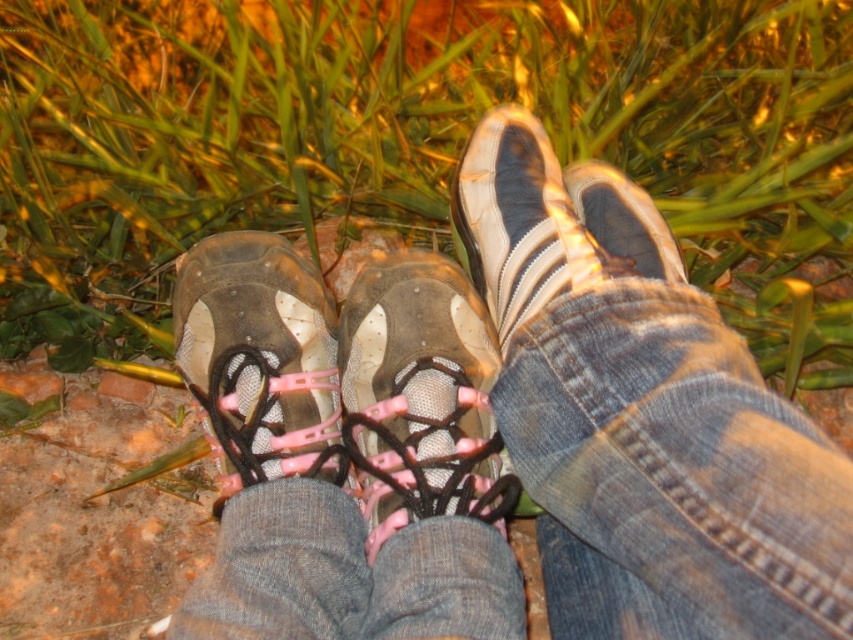
Measure the distance between green grass at center and camera.

The distance of green grass at center from camera is 34.11 inches.

Is point (303, 36) farther from camera compared to point (392, 429)?

Yes, point (303, 36) is behind point (392, 429).

The width and height of the screenshot is (853, 640). What do you see at coordinates (415, 141) in the screenshot?
I see `green grass at center` at bounding box center [415, 141].

The height and width of the screenshot is (640, 853). I want to click on green grass at center, so click(x=415, y=141).

Does point (374, 147) lie in front of point (763, 481)?

No, (374, 147) is further to viewer.

Does green grass at center lie behind pink mesh sneakers at center?

Yes, it is.

Identify the location of green grass at center. (415, 141).

Find the location of a particular element. The width and height of the screenshot is (853, 640). green grass at center is located at coordinates (415, 141).

Who is higher up, pink mesh sneakers at center or matte rubber shoe at center?

matte rubber shoe at center is higher up.

Based on the photo, is pink mesh sneakers at center taller than matte rubber shoe at center?

Correct, pink mesh sneakers at center is much taller as matte rubber shoe at center.

Who is more forward, [741,595] or [196,264]?

Positioned in front is point [741,595].

This screenshot has width=853, height=640. What are the coordinates of `pink mesh sneakers at center` in the screenshot? It's located at (643, 428).